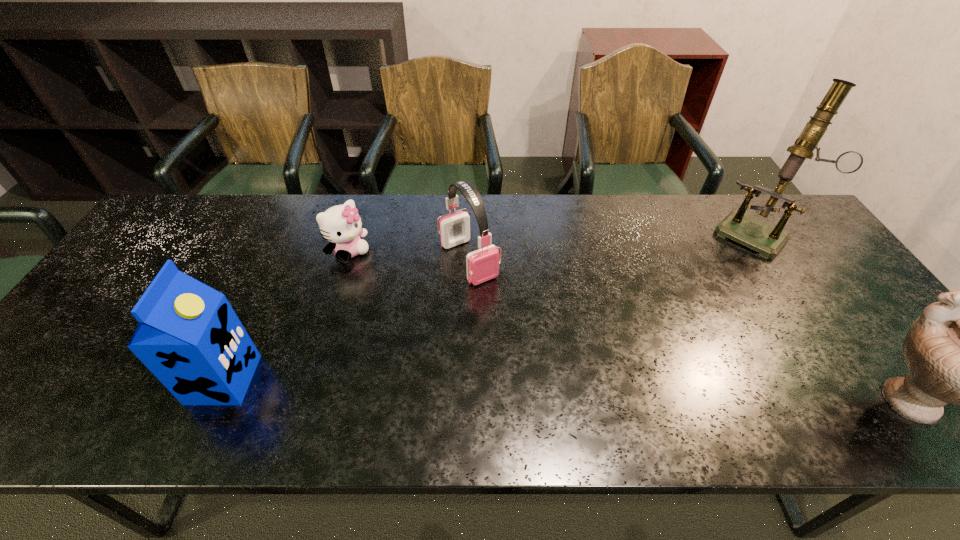
Find the location of a particular element. vacant region between the leftmost object and the third object from left to right is located at coordinates (347, 320).

At what (x,y) coordinates should I click in order to perform the action: click on free space that is in between the carton and the third object from left to right. Please return your answer as a coordinate pair (x, y). The image size is (960, 540). Looking at the image, I should click on (347, 320).

The image size is (960, 540). Identify the location of free space between the third object from left to right and the tallest object. (611, 247).

Locate which object ranks fourth in proximity to the fourth tallest object. Please provide its 2D coordinates. Your answer should be formatted as a tuple, i.e. [(x, y)], where the tuple contains the x and y coordinates of a point satisfying the conditions above.

[(959, 351)]

Image resolution: width=960 pixels, height=540 pixels. I want to click on object that can be found as the third closest to the kitten, so click(768, 240).

Find the location of a particular element. This screenshot has height=540, width=960. free point that satisfies the following two spatial constraints: 1. on the front side of the fourth tallest object; 2. on the right side of the second object from left to right is located at coordinates (347, 261).

Image resolution: width=960 pixels, height=540 pixels. In order to click on free location that satisfies the following two spatial constraints: 1. on the front side of the fourth object from right to left; 2. on the right side of the third object from right to left in this screenshot , I will do `click(347, 261)`.